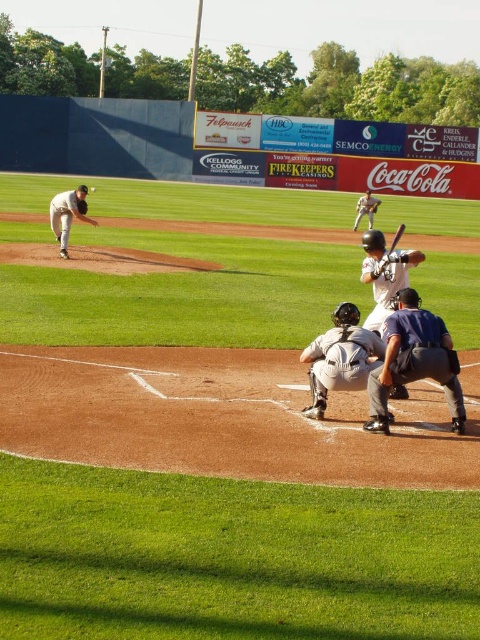
Between matte white bat at center and white matte baseball at center, which one is positioned higher?

white matte baseball at center is higher up.

Between point (384, 314) and point (95, 189), which one is positioned behind?

The point (95, 189) is more distant.

Measure the distance between matte white bat at center and camera.

matte white bat at center and camera are 7.50 meters apart.

The height and width of the screenshot is (640, 480). What are the coordinates of `matte white bat at center` in the screenshot? It's located at (384, 275).

Between white jersey baseball player at center and wooden bat at center, which one appears on the left side from the viewer's perspective?

From the viewer's perspective, wooden bat at center appears more on the left side.

Does point (359, 200) come behind point (388, 257)?

Yes, point (359, 200) is behind point (388, 257).

Is point (357, 211) closer to camera compared to point (383, 262)?

No, (357, 211) is further to viewer.

Identify the location of white jersey baseball player at center. The width and height of the screenshot is (480, 640). (365, 209).

Between wooden baseball bat at center and dark gray leather glove at left, which one has more height?

With more height is wooden baseball bat at center.

Which is behind, point (396, 236) or point (82, 204)?

Positioned behind is point (82, 204).

Where is `wooden baseball bat at center`? wooden baseball bat at center is located at coordinates (396, 237).